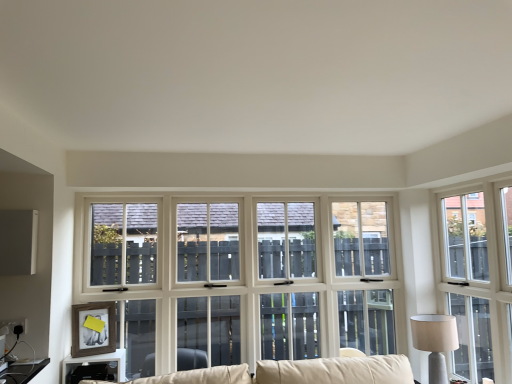
What do you see at coordinates (478, 279) in the screenshot? I see `white wood window at right` at bounding box center [478, 279].

The width and height of the screenshot is (512, 384). Describe the element at coordinates (435, 342) in the screenshot. I see `beige fabric lampshade at right` at that location.

You are a GUI agent. You are given a task and a screenshot of the screen. Output one action in this format:
    pyautogui.click(x=<x>, y=<y>)
    Task: Click on the white wood window at right
    Image resolution: width=512 pixels, height=384 pixels.
    Given the screenshot: What is the action you would take?
    (x=478, y=279)

From the image's perspective, would you say beige fabric lampshade at right is positioned over white wood window at right?

No, from the image's perspective, beige fabric lampshade at right is not above white wood window at right.

From a real-world perspective, relative to white wood window at right, is beige fabric lampshade at right vertically above or below?

From a real-world perspective, beige fabric lampshade at right is physically below white wood window at right.

Is beige fabric lampshade at right wider or thinner than white wood window at right?

Considering their sizes, beige fabric lampshade at right looks broader than white wood window at right.

Would you say white wood window at right is part of beige fabric lampshade at right's contents?

No, white wood window at right is located outside of beige fabric lampshade at right.

Between matte black table at lower left and white wood window at right, which one has larger size?

Bigger between the two is white wood window at right.

Considering the relative sizes of matte black table at lower left and white wood window at right in the image provided, is matte black table at lower left shorter than white wood window at right?

Yes.

From the image's perspective, is matte black table at lower left located above white wood window at right?

Incorrect, from the image's perspective, matte black table at lower left is lower than white wood window at right.

Which is less distant, (120, 366) or (472, 198)?

Point (120, 366) is positioned closer to the camera compared to point (472, 198).

From the image's perspective, which one is positioned higher, white wood window at right or beige fabric lampshade at right?

white wood window at right, from the image's perspective.

Considering the relative positions of white wood window at right and beige fabric lampshade at right in the image provided, is white wood window at right in front of beige fabric lampshade at right?

That is True.

Is point (483, 204) positioned before point (420, 341)?

Yes, point (483, 204) is closer to viewer.

From a real-world perspective, is white wood window at right positioned above or below beige fabric lampshade at right?

From a real-world perspective, white wood window at right is physically above beige fabric lampshade at right.

Consider the image. Is beige fabric lampshade at right at the right side of matte black table at lower left?

Indeed, beige fabric lampshade at right is positioned on the right side of matte black table at lower left.

From a real-world perspective, which object stands above the other?

From a 3D spatial view, beige fabric lampshade at right is above.

From the picture: Could you tell me if beige fabric lampshade at right is turned towards matte black table at lower left?

No, beige fabric lampshade at right is not oriented towards matte black table at lower left.

From their relative heights in the image, would you say beige fabric lampshade at right is taller or shorter than matte black table at lower left?

Considering their sizes, beige fabric lampshade at right has more height than matte black table at lower left.

In the image, is matte black table at lower left on the left side or the right side of beige fabric lampshade at right?

In the image, matte black table at lower left appears on the left side of beige fabric lampshade at right.

From the picture: From a real-world perspective, which is physically above, matte black table at lower left or beige fabric lampshade at right?

beige fabric lampshade at right is physically above.

Is white wood window at right far away from matte black table at lower left?

white wood window at right is positioned a significant distance from matte black table at lower left.

Does white wood window at right appear on the left side of matte black table at lower left?

No, white wood window at right is not to the left of matte black table at lower left.

Is white wood window at right in front of matte black table at lower left?

Yes, it is in front of matte black table at lower left.

Who is shorter, white wood window at right or matte black table at lower left?

matte black table at lower left is shorter.

Where is `window in front of the beige fabric lampshade at right`? The height and width of the screenshot is (384, 512). window in front of the beige fabric lampshade at right is located at coordinates (478, 279).

Find the location of a particular element. table behind the white wood window at right is located at coordinates (95, 367).

From the image, which object appears to be nearer to white wood window at right, beige fabric lampshade at right or matte black table at lower left?

beige fabric lampshade at right is positioned closer to the anchor white wood window at right.

When comparing their distances from white wood window at right, does matte black table at lower left or beige fabric lampshade at right seem further?

matte black table at lower left.

From the image, which object appears to be nearer to beige fabric lampshade at right, matte black table at lower left or white wood window at right?

Based on the image, white wood window at right appears to be nearer to beige fabric lampshade at right.

Which object lies nearer to the anchor point matte black table at lower left, white wood window at right or beige fabric lampshade at right?

beige fabric lampshade at right.

Based on their spatial positions, is beige fabric lampshade at right or white wood window at right further from matte black table at lower left?

white wood window at right is further to matte black table at lower left.

Based on their spatial positions, is white wood window at right or matte black table at lower left closer to beige fabric lampshade at right?

white wood window at right is positioned closer to the anchor beige fabric lampshade at right.

Locate an element on the screen. The height and width of the screenshot is (384, 512). table lamp between matte black table at lower left and white wood window at right from left to right is located at coordinates (435, 342).